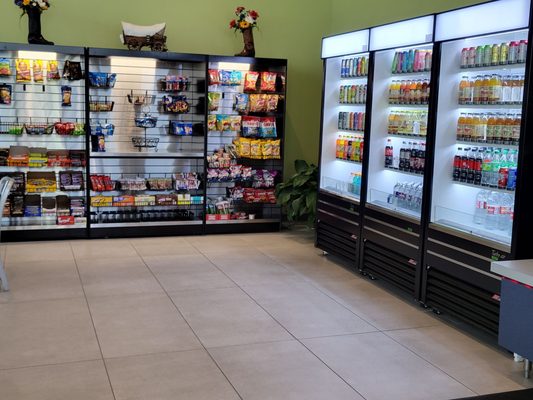
This screenshot has height=400, width=533. In order to click on chair in this screenshot , I will do `click(6, 193)`.